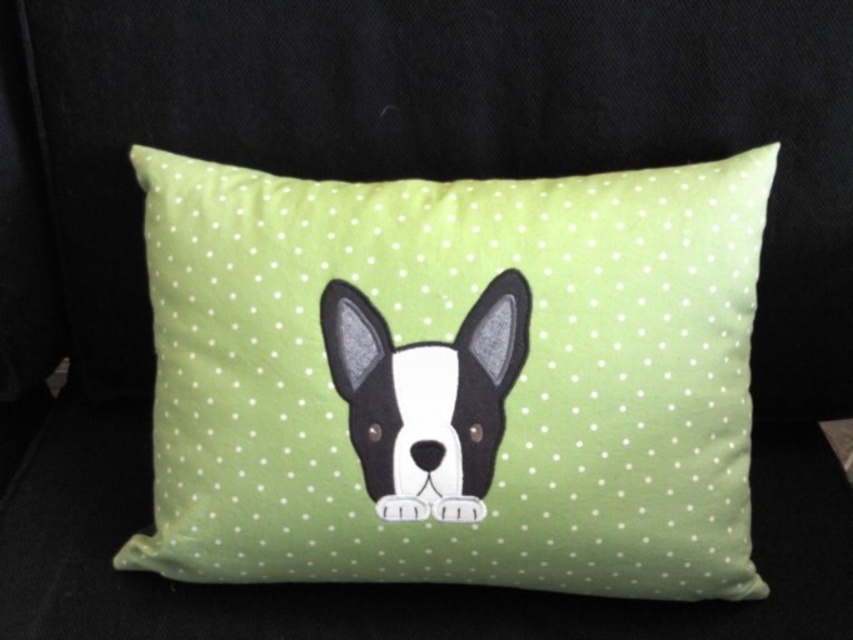
Question: Which of the following is the farthest from the observer?

Choices:
 (A) black felt dog at center
 (B) lime green fabric pillow with polka dots at center

Answer: (B)

Question: Which point is closer to the camera taking this photo?

Choices:
 (A) (444, 400)
 (B) (712, 365)

Answer: (A)

Question: Can you confirm if lime green fabric pillow with polka dots at center is smaller than black felt dog at center?

Choices:
 (A) yes
 (B) no

Answer: (B)

Question: Can you confirm if lime green fabric pillow with polka dots at center is positioned to the right of black felt dog at center?

Choices:
 (A) yes
 (B) no

Answer: (B)

Question: Is lime green fabric pillow with polka dots at center behind black felt dog at center?

Choices:
 (A) no
 (B) yes

Answer: (B)

Question: Which point is closer to the camera?

Choices:
 (A) (508, 330)
 (B) (392, 426)

Answer: (A)